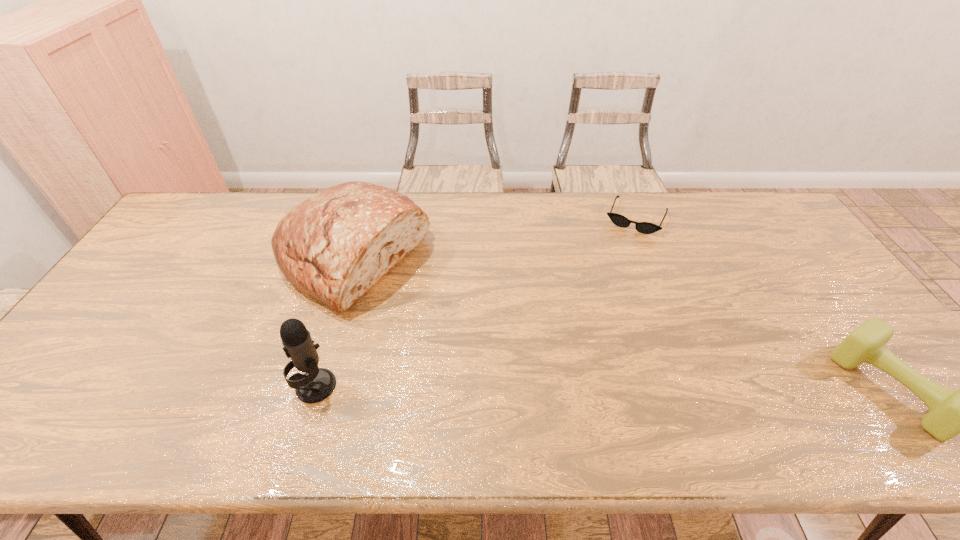
Find the location of a particular element. vacant region located 0.150m on the front-facing side of the sunglasses is located at coordinates pyautogui.click(x=615, y=264).

Locate an element on the screen. bread that is at the far edge is located at coordinates (335, 246).

The width and height of the screenshot is (960, 540). In order to click on sunglasses located in the far edge section of the desktop in this screenshot , I will do `click(619, 220)`.

At what (x,y) coordinates should I click in order to perform the action: click on object at the near edge. Please return your answer as a coordinate pair (x, y). Looking at the image, I should click on (317, 384).

You are a GUI agent. You are given a task and a screenshot of the screen. Output one action in this format:
    pyautogui.click(x=<x>, y=<y>)
    Task: Click on the vacant space at the far edge
    This screenshot has width=960, height=540.
    Given the screenshot: What is the action you would take?
    pyautogui.click(x=488, y=230)

You are a GUI agent. You are given a task and a screenshot of the screen. Output one action in this format:
    pyautogui.click(x=<x>, y=<y>)
    Task: Click on the free location at the near edge
    Image resolution: width=960 pixels, height=540 pixels.
    Given the screenshot: What is the action you would take?
    pyautogui.click(x=726, y=390)

Locate an element on the screen. Image resolution: width=960 pixels, height=540 pixels. free space at the near left corner of the desktop is located at coordinates (61, 381).

Locate an element on the screen. This screenshot has height=540, width=960. free space between the bread and the second object from right to left is located at coordinates (494, 238).

This screenshot has height=540, width=960. What are the coordinates of `free space between the bread and the shortest object` in the screenshot? It's located at (494, 238).

You are a GUI agent. You are given a task and a screenshot of the screen. Output one action in this format:
    pyautogui.click(x=<x>, y=<y>)
    Task: Click on the vacant area that lies between the microphone and the bread
    This screenshot has height=540, width=960.
    Given the screenshot: What is the action you would take?
    pyautogui.click(x=334, y=321)